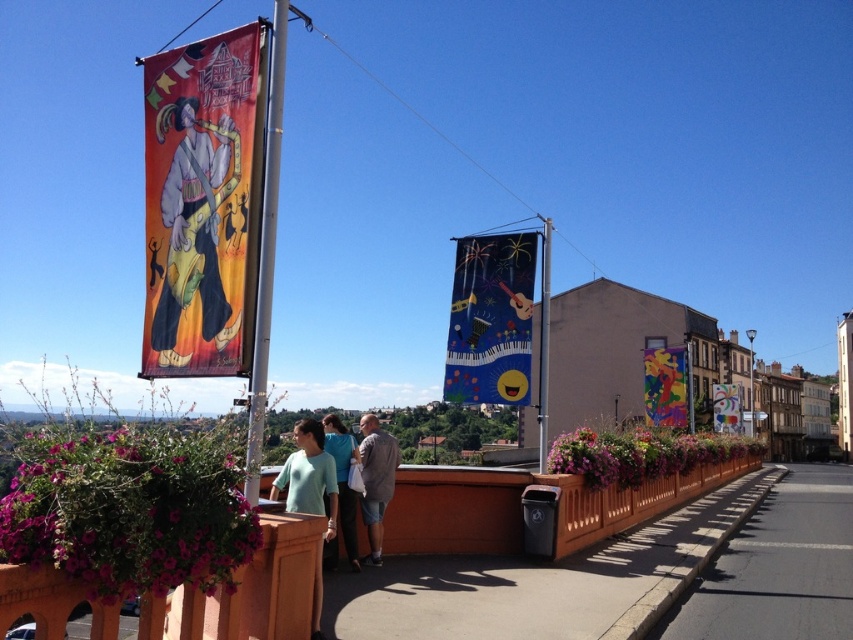
This screenshot has width=853, height=640. Identify the location of blue fabric poster at center. (490, 320).

The height and width of the screenshot is (640, 853). Describe the element at coordinates (490, 320) in the screenshot. I see `blue fabric poster at center` at that location.

Describe the element at coordinates (490, 320) in the screenshot. I see `blue fabric poster at center` at that location.

Where is `blue fabric poster at center`? The height and width of the screenshot is (640, 853). blue fabric poster at center is located at coordinates (490, 320).

Consider the image. Can you confirm if matte paper banner at left is positioned below metallic pole at upper left?

No.

Who is more distant from viewer, (238, 296) or (267, 228)?

The point (238, 296) is behind.

Who is more forward, (218, 264) or (248, 426)?

Point (248, 426) is more forward.

Identify the location of matte paper banner at left. This screenshot has height=640, width=853. (202, 204).

Does blue fabric poster at center come behind metallic pole at upper left?

Yes, blue fabric poster at center is behind metallic pole at upper left.

Who is more distant from viewer, (532, 266) or (274, 83)?

The point (532, 266) is more distant.

What do you see at coordinates (490, 320) in the screenshot? Image resolution: width=853 pixels, height=640 pixels. I see `blue fabric poster at center` at bounding box center [490, 320].

What are the coordinates of `blue fabric poster at center` in the screenshot? It's located at (490, 320).